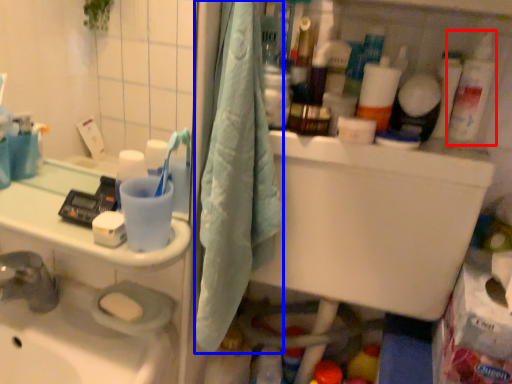
Question: Which object is further to the camera taking this photo, cleaning product (highlighted by a red box) or bath towel (highlighted by a blue box)?

Choices:
 (A) cleaning product
 (B) bath towel

Answer: (A)